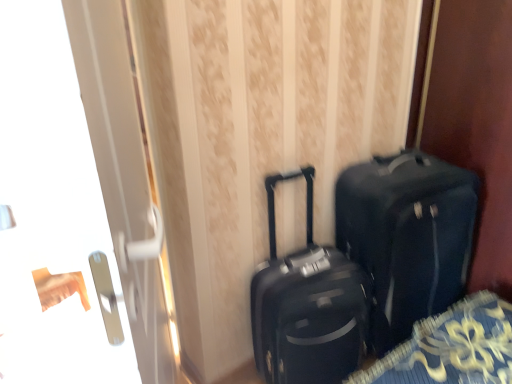
Measure the distance between matte black suitcase at center and camera.

The depth of matte black suitcase at center is 1.30 meters.

Identify the location of transparent glass door at left. (51, 214).

The height and width of the screenshot is (384, 512). What are the coordinates of `matte black suitcase at center` in the screenshot? It's located at (407, 236).

Considering the positions of objects matte black suitcase at center and transparent glass door at left in the image provided, who is more to the right, matte black suitcase at center or transparent glass door at left?

matte black suitcase at center is more to the right.

Based on the photo, which object is wider, matte black suitcase at center or transparent glass door at left?

matte black suitcase at center.

Considering the sizes of objects matte black suitcase at center and transparent glass door at left in the image provided, who is bigger, matte black suitcase at center or transparent glass door at left?

transparent glass door at left.

How many degrees apart are the facing directions of transparent glass door at left and matte black suitcase at center?

13.5 degrees.

Looking at this image, is transparent glass door at left inside the boundaries of matte black suitcase at center, or outside?

transparent glass door at left cannot be found inside matte black suitcase at center.

Which of these two, transparent glass door at left or matte black suitcase at center, is bigger?

With larger size is transparent glass door at left.

Who is more distant, matte black suitcase at center or matte black suitcase at center?

matte black suitcase at center is behind.

From a real-world perspective, does matte black suitcase at center sit lower than matte black suitcase at center?

No, from a real-world perspective, matte black suitcase at center is not under matte black suitcase at center.

Does matte black suitcase at center have a lesser width compared to matte black suitcase at center?

Correct, the width of matte black suitcase at center is less than that of matte black suitcase at center.

Which object is thinner, matte black suitcase at center or transparent glass door at left?

With smaller width is transparent glass door at left.

Between matte black suitcase at center and transparent glass door at left, which one is positioned in front?

transparent glass door at left.

Considering the relative sizes of matte black suitcase at center and transparent glass door at left in the image provided, is matte black suitcase at center taller than transparent glass door at left?

In fact, matte black suitcase at center may be shorter than transparent glass door at left.

Looking at this image, from the image's perspective, is matte black suitcase at center above or below transparent glass door at left?

From the image's perspective, matte black suitcase at center appears above transparent glass door at left.

In terms of height, does matte black suitcase at center look taller or shorter compared to matte black suitcase at center?

Clearly, matte black suitcase at center is taller compared to matte black suitcase at center.

Locate an element on the screen. The image size is (512, 384). luggage and bags lying above the matte black suitcase at center (from the image's perspective) is located at coordinates (407, 236).

From a real-world perspective, relative to matte black suitcase at center, is matte black suitcase at center vertically above or below?

matte black suitcase at center is situated lower than matte black suitcase at center in the real world.

Are matte black suitcase at center and matte black suitcase at center located far from each other?

No, matte black suitcase at center is not far away from matte black suitcase at center.

From a real-world perspective, is transparent glass door at left located beneath matte black suitcase at center?

No.

Based on the photo, from the image's perspective, who appears lower, transparent glass door at left or matte black suitcase at center?

matte black suitcase at center is shown below in the image.

Is transparent glass door at left to the right of matte black suitcase at center from the viewer's perspective?

Incorrect, transparent glass door at left is not on the right side of matte black suitcase at center.

Is transparent glass door at left taller or shorter than matte black suitcase at center?

transparent glass door at left is taller than matte black suitcase at center.

The image size is (512, 384). I want to click on screen door above the matte black suitcase at center (from a real-world perspective), so (x=51, y=214).

The width and height of the screenshot is (512, 384). Find the location of `luggage and bags located on the right of transparent glass door at left`. luggage and bags located on the right of transparent glass door at left is located at coordinates (407, 236).

Based on their spatial positions, is matte black suitcase at center or transparent glass door at left further from matte black suitcase at center?

The object further to matte black suitcase at center is transparent glass door at left.

Which object lies further to the anchor point matte black suitcase at center, transparent glass door at left or matte black suitcase at center?

Based on the image, transparent glass door at left appears to be further to matte black suitcase at center.

Estimate the real-world distances between objects in this image. Which object is closer to matte black suitcase at center, transparent glass door at left or matte black suitcase at center?

The object closer to matte black suitcase at center is matte black suitcase at center.

Which object lies nearer to the anchor point matte black suitcase at center, matte black suitcase at center or transparent glass door at left?

The object closer to matte black suitcase at center is matte black suitcase at center.

Considering their positions, is matte black suitcase at center positioned further to transparent glass door at left than matte black suitcase at center?

Among the two, matte black suitcase at center is located further to transparent glass door at left.

Which object lies nearer to the anchor point transparent glass door at left, matte black suitcase at center or matte black suitcase at center?

matte black suitcase at center.

Where is `suitcase between transparent glass door at left and matte black suitcase at center in the front-back direction`? Image resolution: width=512 pixels, height=384 pixels. suitcase between transparent glass door at left and matte black suitcase at center in the front-back direction is located at coordinates (308, 306).